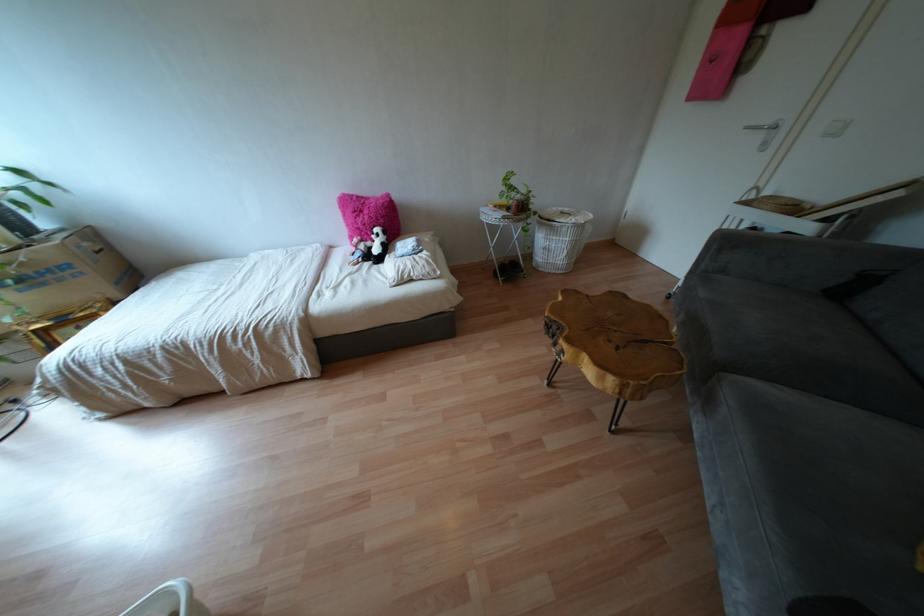
Locate an element on the screen. The height and width of the screenshot is (616, 924). silver door handle is located at coordinates (764, 127).